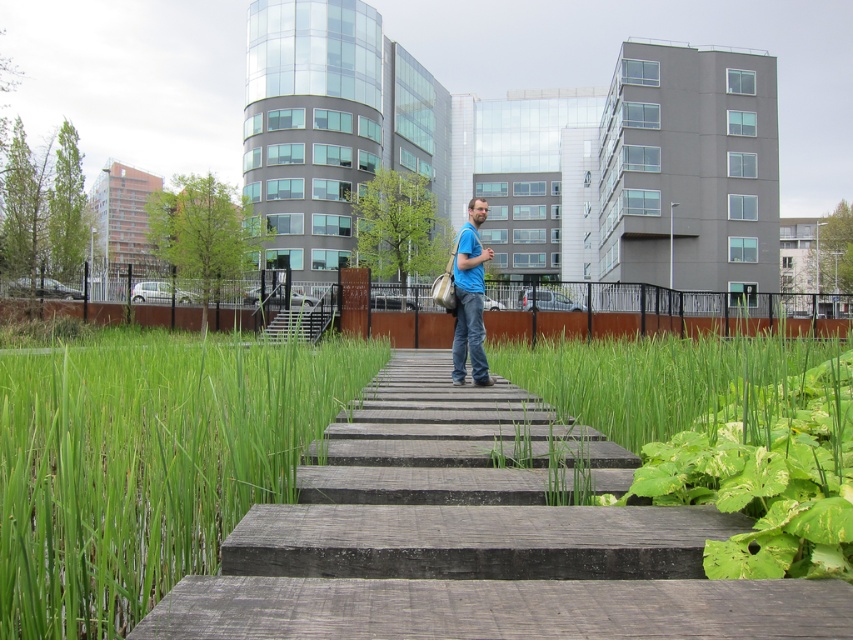
Question: Which is farther from the green leafy grass at center?

Choices:
 (A) blue fabric bag at center
 (B) green grass at center
 (C) wooden stairs at center

Answer: (C)

Question: Considering the relative positions of green grass at center and blue fabric bag at center in the image provided, where is green grass at center located with respect to blue fabric bag at center?

Choices:
 (A) below
 (B) above

Answer: (A)

Question: Is green grass at center below wooden stairs at center?

Choices:
 (A) yes
 (B) no

Answer: (A)

Question: Which point is farther from the camera taking this photo?

Choices:
 (A) 462,378
 (B) 132,602
 (C) 283,333
 (D) 677,444

Answer: (C)

Question: Which point is closer to the camera?

Choices:
 (A) pyautogui.click(x=48, y=525)
 (B) pyautogui.click(x=482, y=376)
 (C) pyautogui.click(x=299, y=330)
 (D) pyautogui.click(x=727, y=556)

Answer: (A)

Question: Is green grass at center above green leafy grass at center?

Choices:
 (A) no
 (B) yes

Answer: (B)